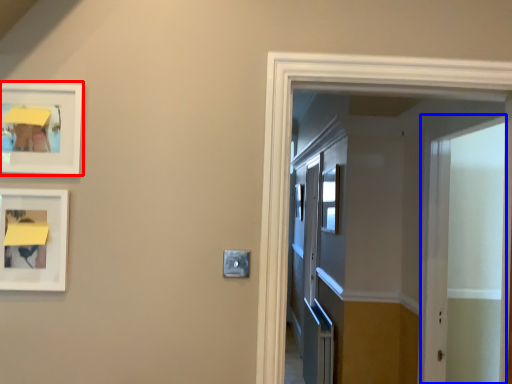
Question: Which object is closer to the camera taking this photo, picture frame (highlighted by a red box) or screen door (highlighted by a blue box)?

Choices:
 (A) picture frame
 (B) screen door

Answer: (A)